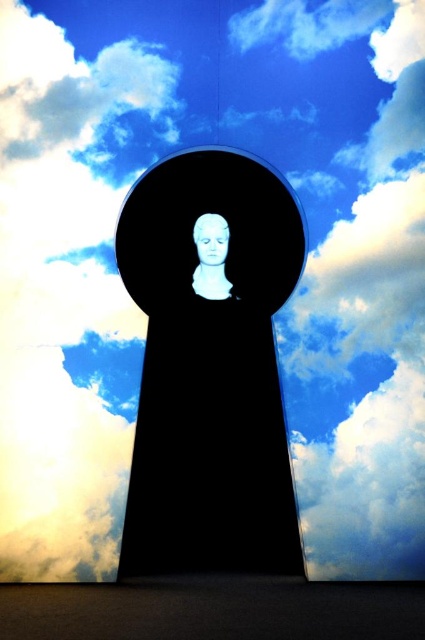
Question: Which point is farther to the camera?

Choices:
 (A) white marble bust at center
 (B) white matte face at center

Answer: (B)

Question: Which object appears closest to the camera in this image?

Choices:
 (A) white matte face at center
 (B) white marble bust at center

Answer: (B)

Question: Can you confirm if white marble bust at center is positioned below white matte face at center?

Choices:
 (A) no
 (B) yes

Answer: (B)

Question: Which point is closer to the camera taking this photo?

Choices:
 (A) (217, 253)
 (B) (206, 212)

Answer: (A)

Question: Is white marble bust at center bigger than white matte face at center?

Choices:
 (A) yes
 (B) no

Answer: (A)

Question: Does white marble bust at center appear on the left side of white matte face at center?

Choices:
 (A) yes
 (B) no

Answer: (A)